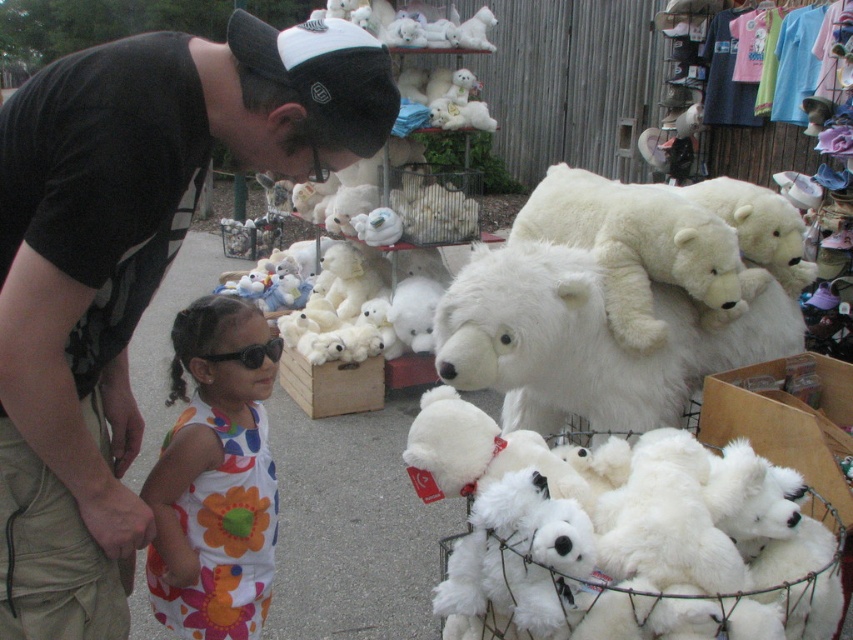
Question: Which is farther from the fluffy white bear at center?

Choices:
 (A) white plush bear at center
 (B) black fabric cap at upper center

Answer: (B)

Question: Does white plush bears at center have a greater width compared to white plush bear at center?

Choices:
 (A) yes
 (B) no

Answer: (A)

Question: Which object is closer to the camera taking this photo?

Choices:
 (A) black fabric cap at upper center
 (B) black plastic goggles at center
 (C) floral fabric dress at lower left

Answer: (A)

Question: In this image, where is black fabric cap at upper center located relative to fluffy white bear at center?

Choices:
 (A) above
 (B) below

Answer: (A)

Question: Can you confirm if white plush bears at center is smaller than black plastic goggles at center?

Choices:
 (A) no
 (B) yes

Answer: (A)

Question: Which object is positioned farthest from the floral fabric dress at lower left?

Choices:
 (A) black plastic goggles at center
 (B) white plush bears at center

Answer: (B)